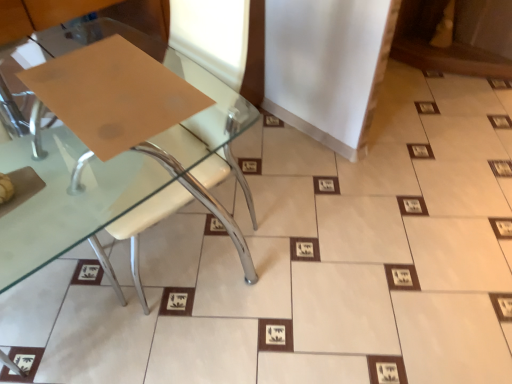
At what (x,y) coordinates should I click in order to perform the action: click on vacant area located to the right-hand side of matte brown paper at lower left. Please return your answer as a coordinate pair (x, y). Image resolution: width=512 pixels, height=384 pixels. Looking at the image, I should click on (293, 238).